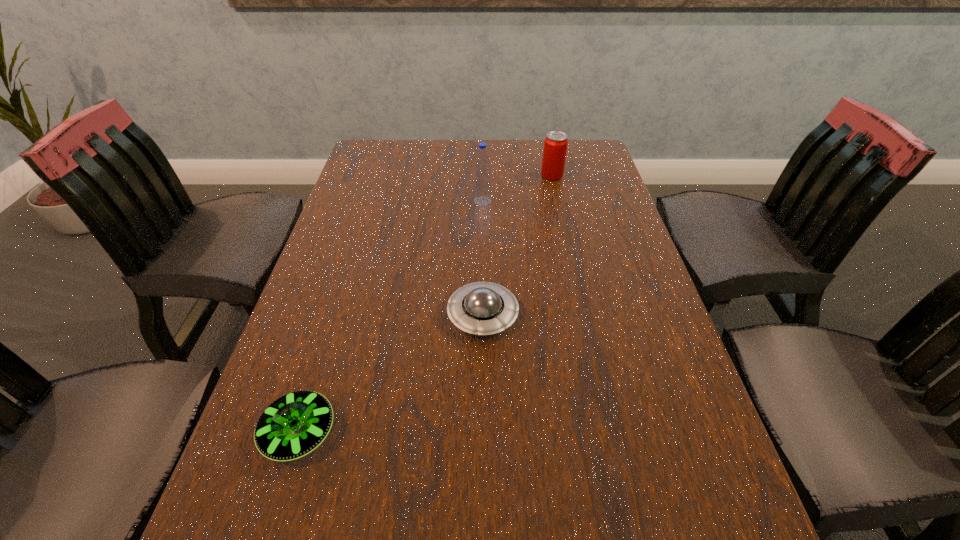
Where is `water bottle`? The image size is (960, 540). water bottle is located at coordinates (482, 184).

Find the location of a particular element. the second farthest object is located at coordinates (482, 184).

What are the coordinates of `the third shortest object` in the screenshot? It's located at (555, 145).

Where is `the farthest object`? the farthest object is located at coordinates (555, 145).

Identify the location of the right saucer. The height and width of the screenshot is (540, 960). (482, 308).

Find the location of a particular element. The width and height of the screenshot is (960, 540). the farther saucer is located at coordinates (482, 308).

I want to click on the leftmost object, so click(295, 424).

You are a GUI agent. You are given a task and a screenshot of the screen. Output one action in this format:
    pyautogui.click(x=<x>, y=<y>)
    Task: Click on the nearer saucer
    This screenshot has width=960, height=540.
    Given the screenshot: What is the action you would take?
    coord(295,424)

Locate an element on the screen. free point located 0.160m on the front of the tallest object is located at coordinates (483, 242).

Identify the location of free space located 0.390m on the front of the rightmost object. (573, 270).